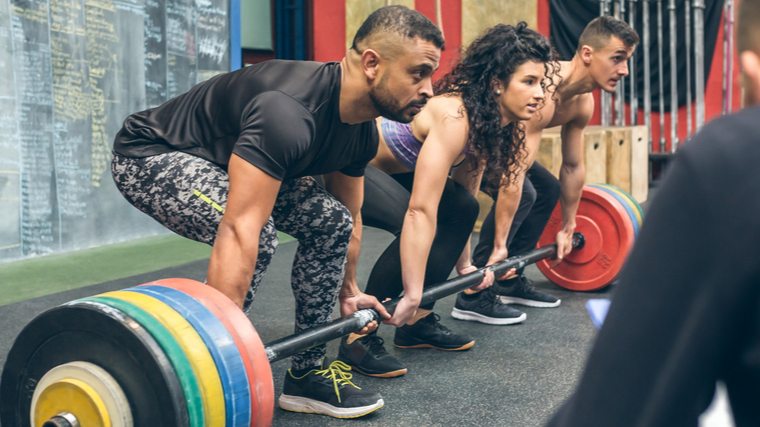
At what (x,y) coordinates should I click in order to perform the action: click on shoe. Please return your answer as a coordinate pair (x, y). Looking at the image, I should click on (530, 294), (496, 310), (439, 338), (375, 360), (334, 392).